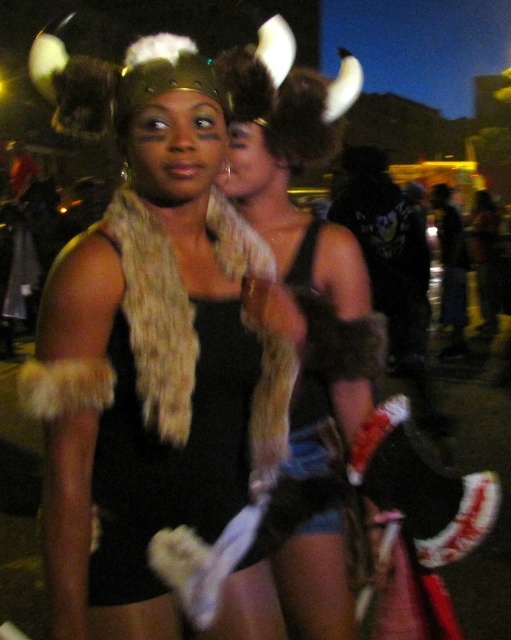
Question: Which object is closer to the camera taking this photo?

Choices:
 (A) fur-like scarf at center
 (B) fur scarf at center
 (C) dark blue fabric pants at lower right

Answer: (B)

Question: Observing the image, what is the correct spatial positioning of fur scarf at center in reference to fur-like scarf at center?

Choices:
 (A) right
 (B) left

Answer: (B)

Question: Which of the following is the farthest from the observer?

Choices:
 (A) fur-like scarf at center
 (B) fur scarf at center

Answer: (A)

Question: Is fur-like scarf at center positioned in front of dark blue fabric pants at lower right?

Choices:
 (A) yes
 (B) no

Answer: (A)

Question: Which of the following is the closest to the observer?

Choices:
 (A) fur scarf at center
 (B) fur-like scarf at center

Answer: (A)

Question: Observing the image, what is the correct spatial positioning of fur-like scarf at center in reference to dark blue fabric pants at lower right?

Choices:
 (A) left
 (B) right

Answer: (A)